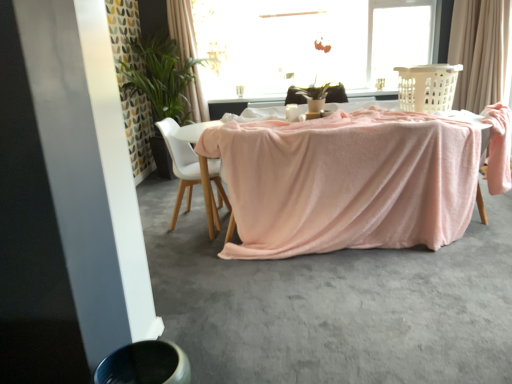
Find the location of a particular element. The image size is (512, 384). space that is in front of pink velvety table at center is located at coordinates (360, 308).